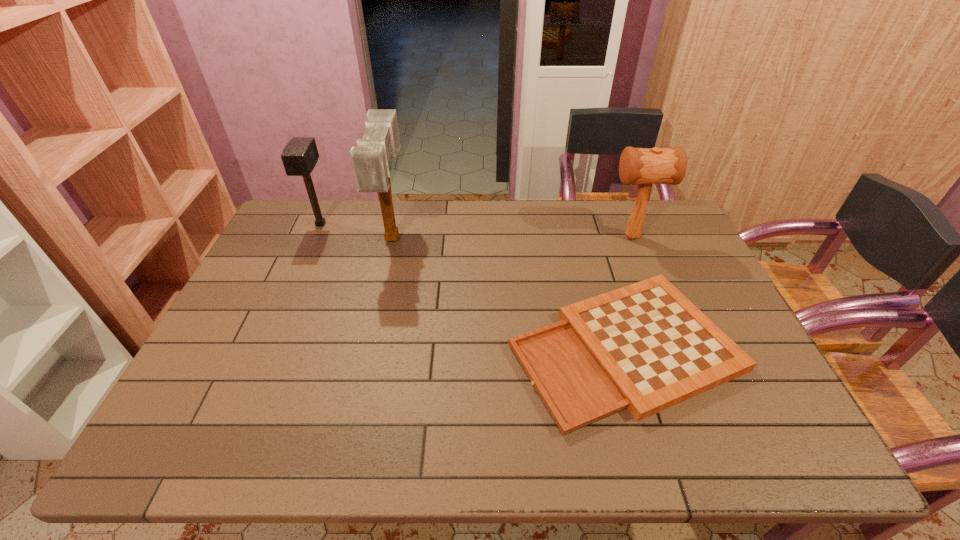
Identify the location of free space at the near edge of the desktop. This screenshot has width=960, height=540. (328, 460).

Where is `vacant space at the left edge of the desktop`? The height and width of the screenshot is (540, 960). vacant space at the left edge of the desktop is located at coordinates (199, 417).

What are the coordinates of `free point at the right edge` in the screenshot? It's located at (660, 272).

Where is `vacant point at the far left corner`? vacant point at the far left corner is located at coordinates 302,234.

Where is `blank space at the far right corner of the desktop`? This screenshot has width=960, height=540. blank space at the far right corner of the desktop is located at coordinates (670, 220).

This screenshot has width=960, height=540. What are the coordinates of `empty space between the leftmost object and the shortest object` in the screenshot? It's located at (472, 286).

At what (x,y) coordinates should I click in order to perform the action: click on empty location between the third object from right to left and the nearest object. Please return your answer as a coordinate pair (x, y). Looking at the image, I should click on (508, 293).

Identify the location of free space between the gameboard and the leftmost mallet. (472, 286).

This screenshot has height=540, width=960. Find the location of `empty location between the second mallet from left to right and the nearest object`. empty location between the second mallet from left to right and the nearest object is located at coordinates (508, 293).

Image resolution: width=960 pixels, height=540 pixels. I want to click on vacant area that lies between the leftmost object and the second mallet from right to left, so click(x=357, y=231).